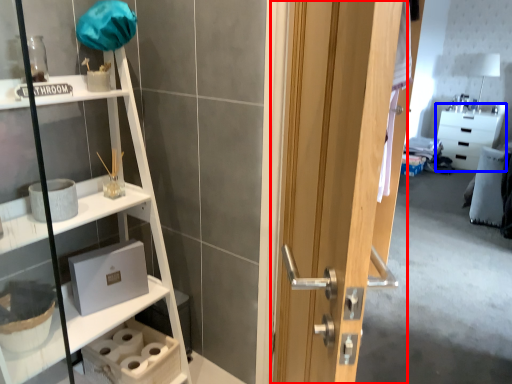
Question: Which point is closer to the camera, door (highlighted by a red box) or cabinetry (highlighted by a blue box)?

Choices:
 (A) door
 (B) cabinetry

Answer: (A)